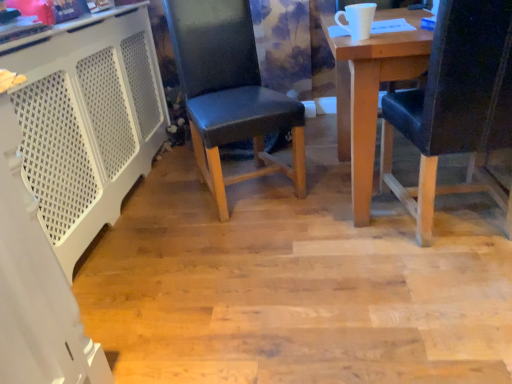
In order to click on vacant area situated to the left side of black leather chair at right, the 1th chair in the right-to-left sequence in this screenshot , I will do coord(337,248).